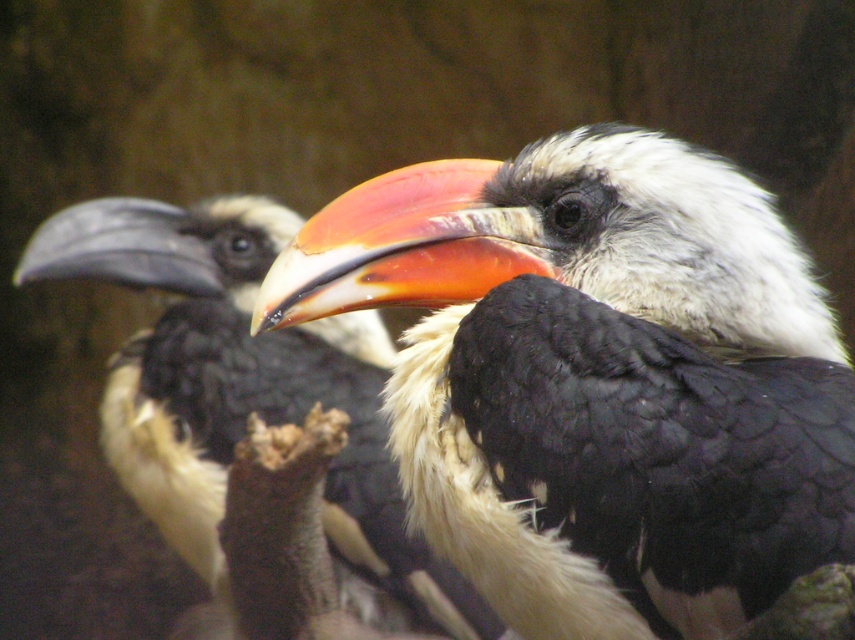
Between point (534, 195) and point (311, 342), which one is positioned in front?

Point (534, 195)

Between point (444, 536) and point (146, 248), which one is positioned behind?

The point (146, 248) is behind.

Does point (351, 253) come closer to viewer compared to point (190, 308)?

Yes, it is.

Locate an element on the screen. This screenshot has width=855, height=640. white matte beak at center is located at coordinates (597, 378).